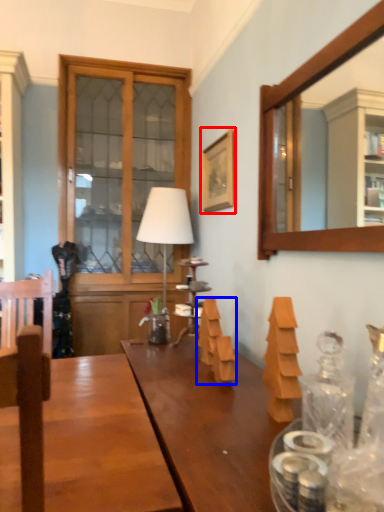
Question: Which object appears farthest to the camera in this image, picture frame (highlighted by a red box) or wood (highlighted by a blue box)?

Choices:
 (A) picture frame
 (B) wood

Answer: (A)